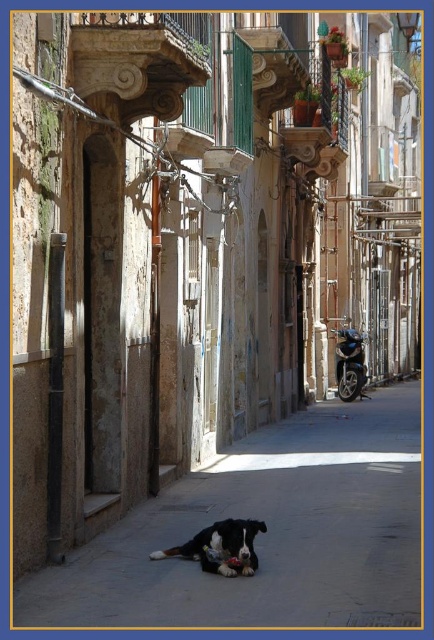
You are a photographer setting up a tripod in the narrow alleyway. You need to place the tripod on the smooth concrete pavement at center without blocking the black fur dog at center. Is there enough space for both the tripod and the dog?

The smooth concrete pavement at center is not as tall as the black fur dog at center, but since the pavement is at the same center position, there might be enough space for both the tripod and the dog as long as they are placed side by side.